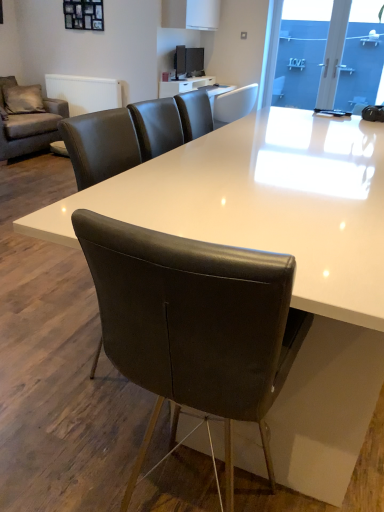
Question: Looking at the image, does blue glass door at upper right seem bigger or smaller compared to white leather chair at upper center, the first chair viewed from the back?

Choices:
 (A) small
 (B) big

Answer: (A)

Question: Is blue glass door at upper right taller or shorter than white leather chair at upper center, which ranks as the 2th chair in bottom-to-top order?

Choices:
 (A) short
 (B) tall

Answer: (B)

Question: Which of these objects is positioned farthest from the transparent glass door at upper right?

Choices:
 (A) blue glass door at upper right
 (B) dark gray fabric couch at upper left
 (C) white leather chair at upper center, the first chair when ordered from top to bottom
 (D) leather at center, which appears as the second chair when viewed from the top

Answer: (B)

Question: Estimate the real-world distances between objects in this image. Which object is closer to the transparent glass door at upper right?

Choices:
 (A) dark gray fabric couch at upper left
 (B) white leather chair at upper center, the first chair when ordered from top to bottom
 (C) blue glass door at upper right
 (D) leather at center, which appears as the second chair when viewed from the top

Answer: (C)